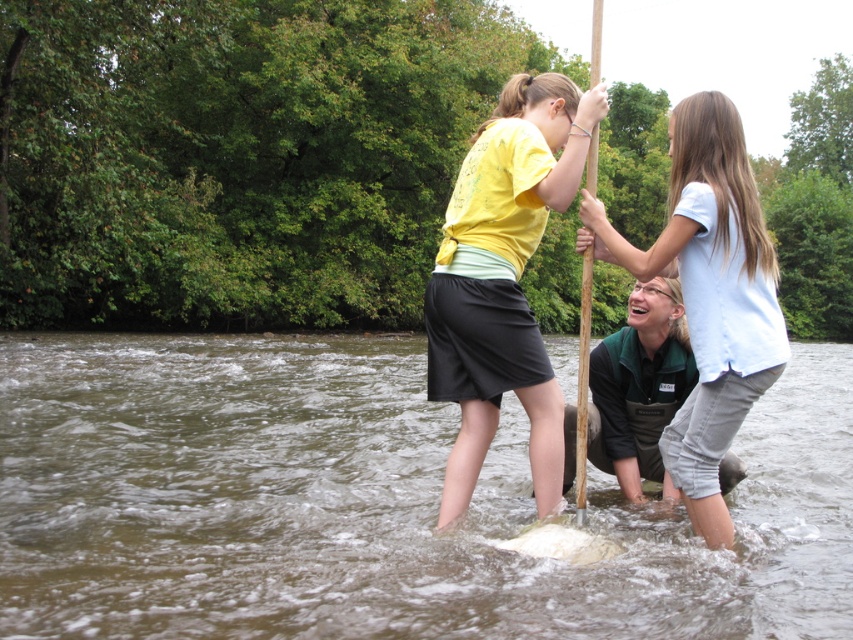
You are a photographer trying to capture the scene with a camera. You notice the white cotton shirt at upper center and the brown wood paddle at center in your viewfinder. Which object should you focus on if you want to highlight the smaller one?

The white cotton shirt at upper center is smaller than the brown wood paddle at center, so you should focus on the white cotton shirt at upper center to highlight the smaller one.

You are a kayaker who just capsized in the river. You see the brown wood paddle at center and the brown muddy water at center. Which object is closer to your face?

The brown wood paddle at center is closer to your face because the brown muddy water at center is located below it.

You are standing at the point labeled as point (755, 186) and want to reach the point labeled as point (491, 600). Which direction should you move to get there?

To reach point (491, 600) from point (755, 186), you should move forward since point (491, 600) is in front of point (755, 186).